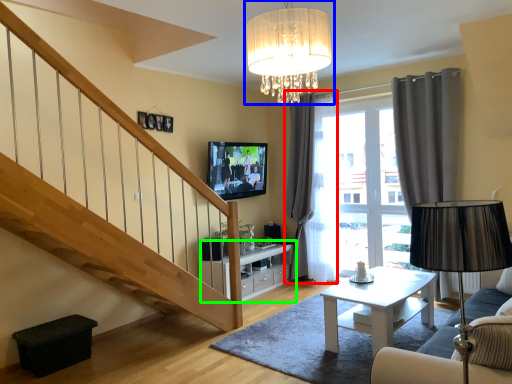
Question: Based on their relative distances, which object is farther from curtain (highlighted by a red box)? Choose from lamp (highlighted by a blue box) and cabinetry (highlighted by a green box).

Choices:
 (A) lamp
 (B) cabinetry

Answer: (A)